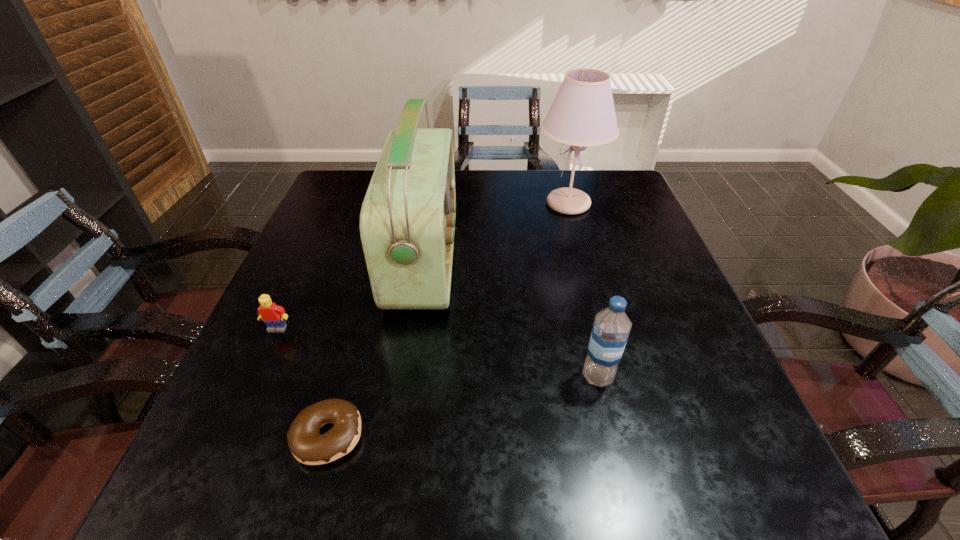
In order to click on object that is at the far right corner in this screenshot , I will do `click(582, 114)`.

Where is `vacant space at the far edge of the desktop`? The height and width of the screenshot is (540, 960). vacant space at the far edge of the desktop is located at coordinates (503, 202).

In the image, there is a desktop. At what (x,y) coordinates should I click in order to perform the action: click on free space at the near edge. Please return your answer as a coordinate pair (x, y). Looking at the image, I should click on (475, 480).

Where is `free spot at the left edge of the desktop`? The height and width of the screenshot is (540, 960). free spot at the left edge of the desktop is located at coordinates (339, 321).

Identify the location of blank space at the right edge of the desktop. (710, 357).

Image resolution: width=960 pixels, height=540 pixels. I want to click on vacant region at the far left corner of the desktop, so click(x=359, y=174).

This screenshot has width=960, height=540. In the image, there is a desktop. What are the coordinates of `free space at the far right corner` in the screenshot? It's located at (604, 188).

What are the coordinates of `empty space between the radio receiver and the nearest object` in the screenshot? It's located at (376, 348).

The height and width of the screenshot is (540, 960). Identify the location of vacant area that lies between the leftmost object and the doughnut. (302, 382).

The height and width of the screenshot is (540, 960). Identify the location of free space between the radio receiver and the lampshade. (496, 232).